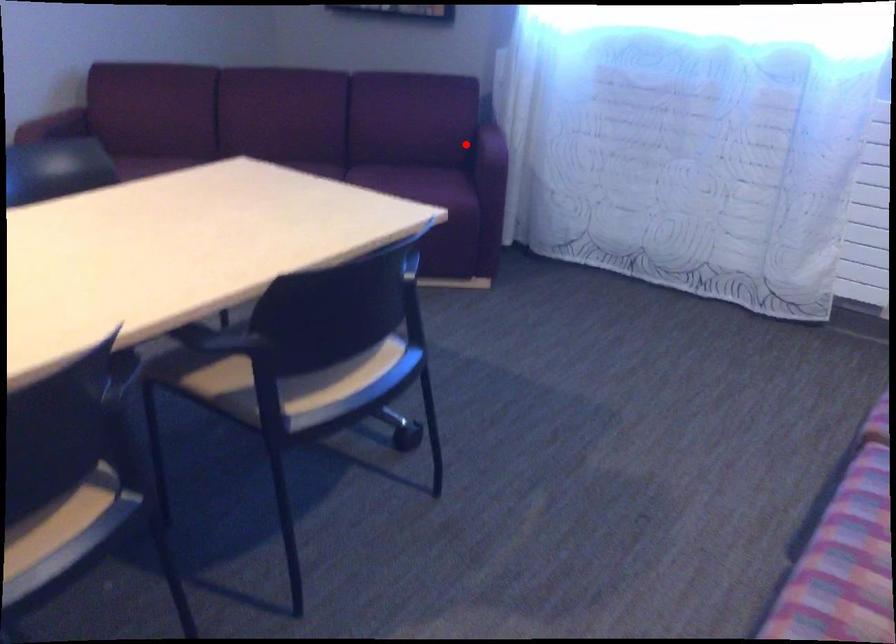
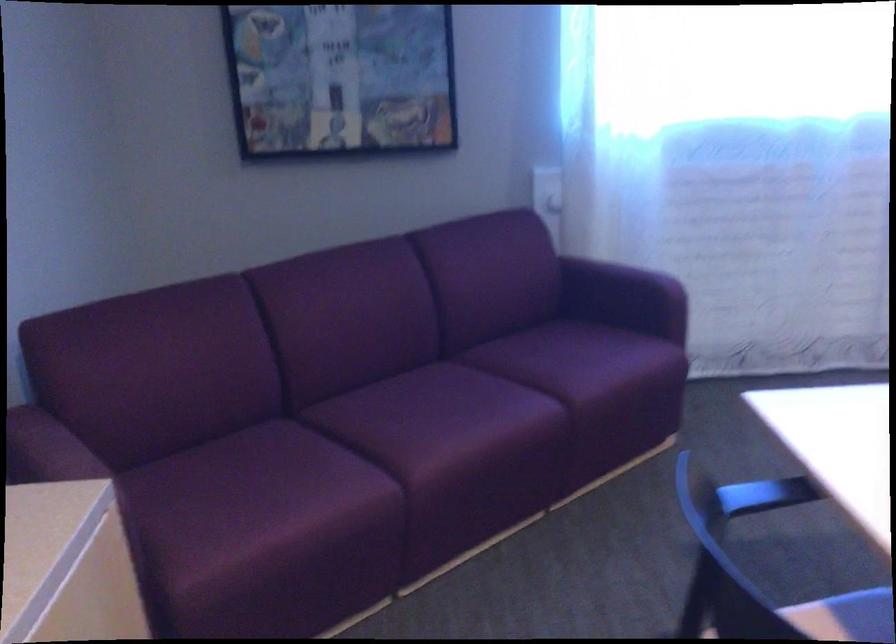
Question: I am providing you with two images of the same scene from different viewpoints. A red point is shown in image1. For the corresponding object point in image2, is it positioned nearer or farther from the camera?

Choices:
 (A) Nearer
 (B) Farther

Answer: (A)